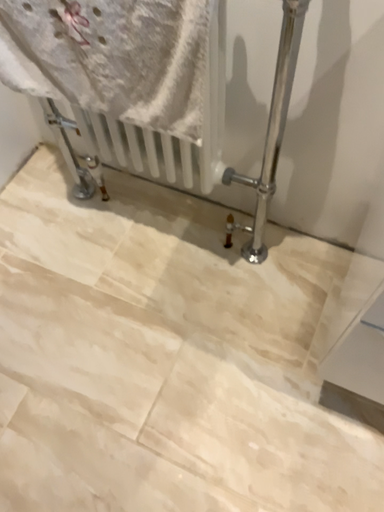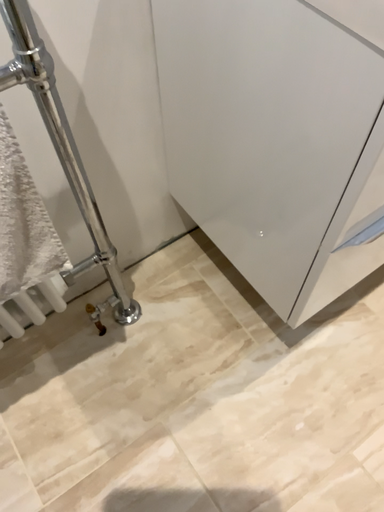
Question: How did the camera likely rotate when shooting the video?

Choices:
 (A) rotated left
 (B) rotated right

Answer: (B)